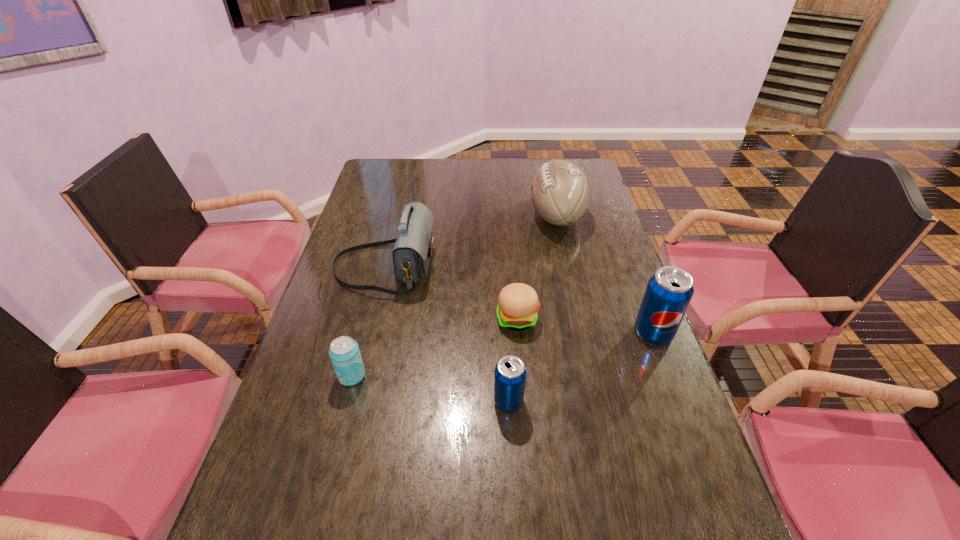
Where is `vacant space positioned on the laces of the second object from right to left`? This screenshot has height=540, width=960. vacant space positioned on the laces of the second object from right to left is located at coordinates coord(472,216).

Where is `blank space located on the laces of the second object from right to left`? Image resolution: width=960 pixels, height=540 pixels. blank space located on the laces of the second object from right to left is located at coordinates (478, 216).

Identify the location of free point located on the laces of the second object from right to left. The image size is (960, 540). (458, 216).

This screenshot has width=960, height=540. What are the coordinates of `vacant space situated 0.210m on the back of the shoulder bag` in the screenshot? It's located at (399, 205).

Identify the location of vacant space situated 0.130m on the left of the hamburger. (448, 319).

The height and width of the screenshot is (540, 960). What are the coordinates of `blank area located 0.200m on the right of the beer can` in the screenshot? It's located at (448, 376).

The height and width of the screenshot is (540, 960). What are the coordinates of `shoulder bag that is at the left edge` in the screenshot? It's located at (411, 254).

The image size is (960, 540). I want to click on beer can that is positioned at the left edge, so click(x=344, y=352).

This screenshot has height=540, width=960. What are the coordinates of `pop soda that is at the right edge` in the screenshot? It's located at (669, 291).

Locate an element on the screen. Image resolution: width=960 pixels, height=540 pixels. football (American) present at the right edge is located at coordinates (559, 192).